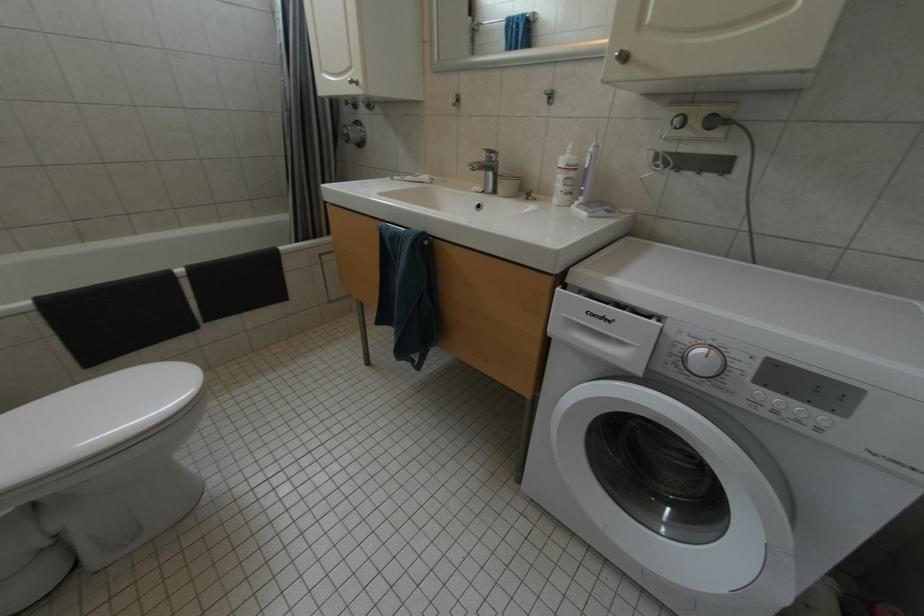
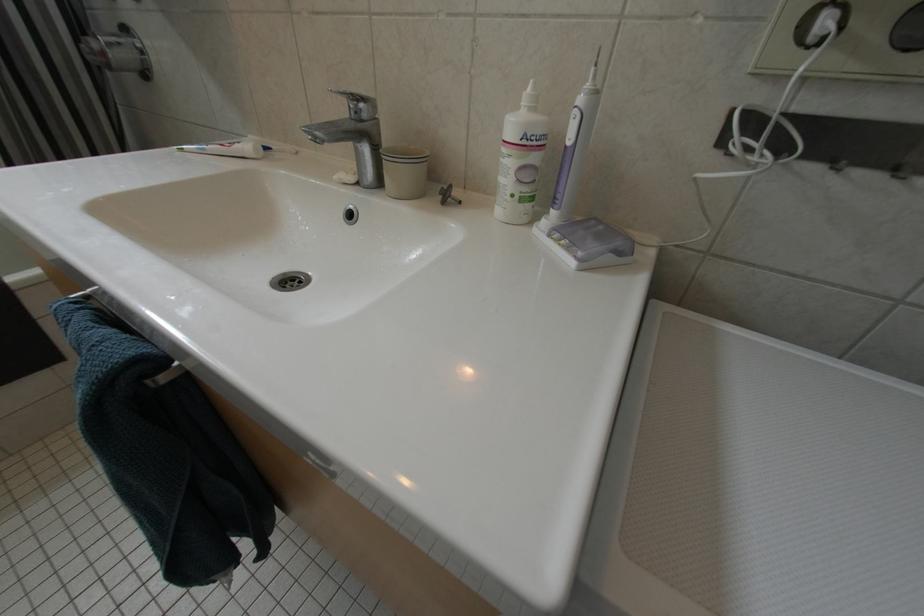
Question: The images are taken continuously from a first-person perspective. In which direction are you moving?

Choices:
 (A) Left
 (B) Right
 (C) Forward
 (D) Backward

Answer: (C)